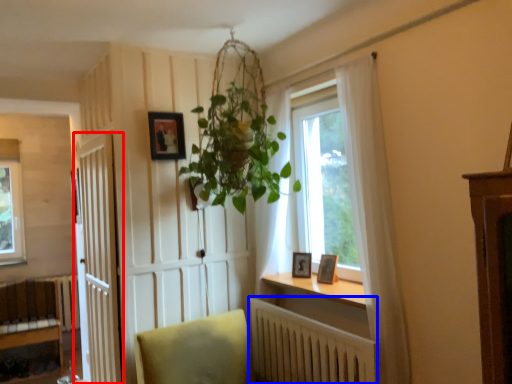
Question: Which object is further to the camera taking this photo, door (highlighted by a red box) or radiator (highlighted by a blue box)?

Choices:
 (A) door
 (B) radiator

Answer: (A)